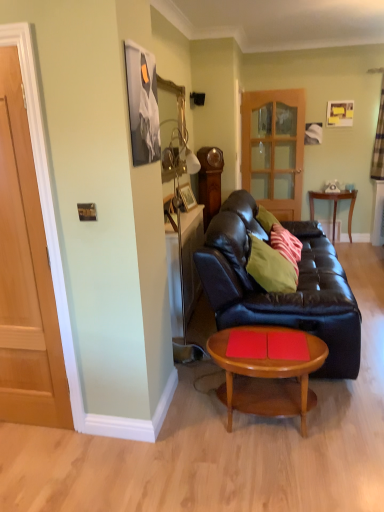
This screenshot has width=384, height=512. I want to click on free space between light brown wooden coffee table at center and matte black leather couch at center, so click(x=321, y=412).